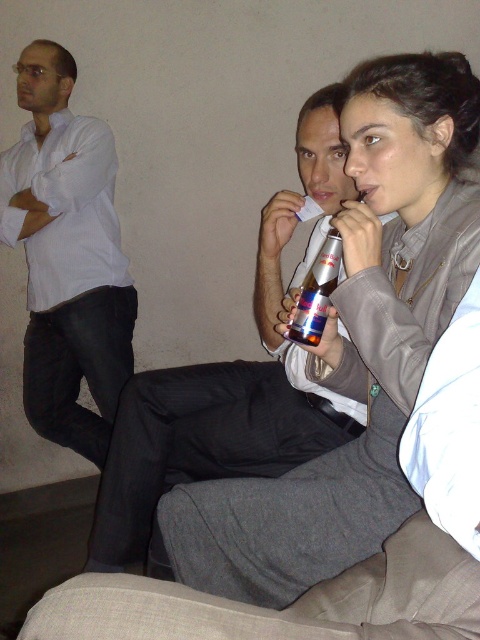
Question: Which point is farther to the camera?

Choices:
 (A) (264, 369)
 (B) (50, 326)

Answer: (B)

Question: Which point appears farthest from the camera in this image?

Choices:
 (A) (305, 300)
 (B) (299, 166)

Answer: (B)

Question: Can you confirm if dark gray suit at center is bigger than red metallic can at center?

Choices:
 (A) no
 (B) yes

Answer: (B)

Question: Does dark gray suit at center appear over red metallic can at center?

Choices:
 (A) no
 (B) yes

Answer: (A)

Question: Among these objects, which one is farthest from the camera?

Choices:
 (A) red metallic can at center
 (B) white shirt at left
 (C) dark gray suit at center

Answer: (B)

Question: Is the position of dark gray suit at center more distant than that of red metallic can at center?

Choices:
 (A) no
 (B) yes

Answer: (B)